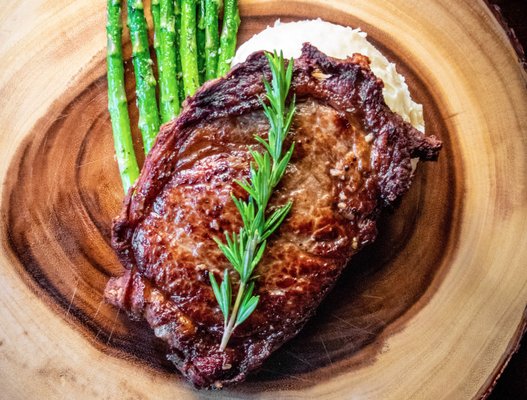
Image resolution: width=527 pixels, height=400 pixels. What are the coordinates of `plate` in the screenshot? It's located at (452, 351).